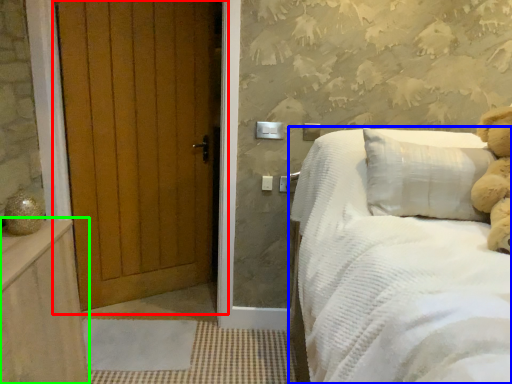
Question: Which is nearer to the door (highlighted by a red box)? bed (highlighted by a blue box) or balustrade (highlighted by a green box).

Choices:
 (A) bed
 (B) balustrade

Answer: (B)